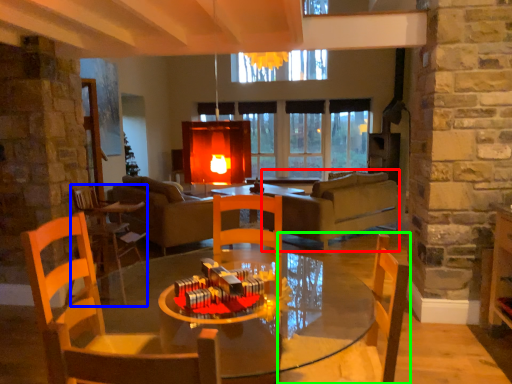
Question: Which is farther away from couch (highlighted by a red box)? chair (highlighted by a blue box) or chair (highlighted by a green box)?

Choices:
 (A) chair
 (B) chair

Answer: (B)